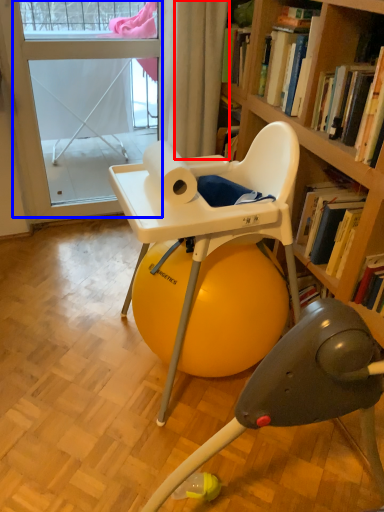
Question: Which object appears closest to the camera in this image, curtain (highlighted by a red box) or screen door (highlighted by a blue box)?

Choices:
 (A) curtain
 (B) screen door

Answer: (A)